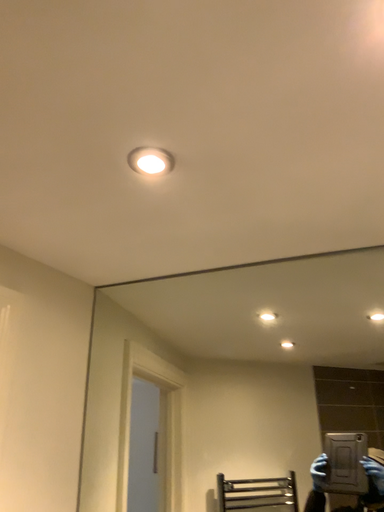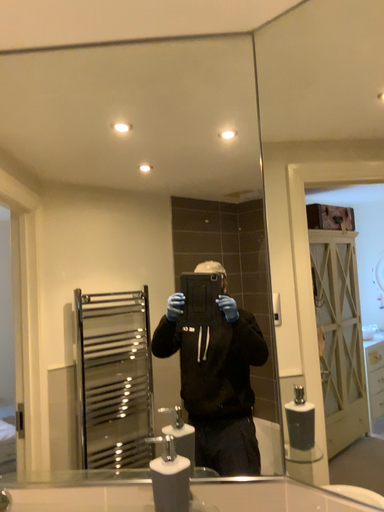
Question: Which way did the camera rotate in the video?

Choices:
 (A) rotated right
 (B) rotated left

Answer: (A)